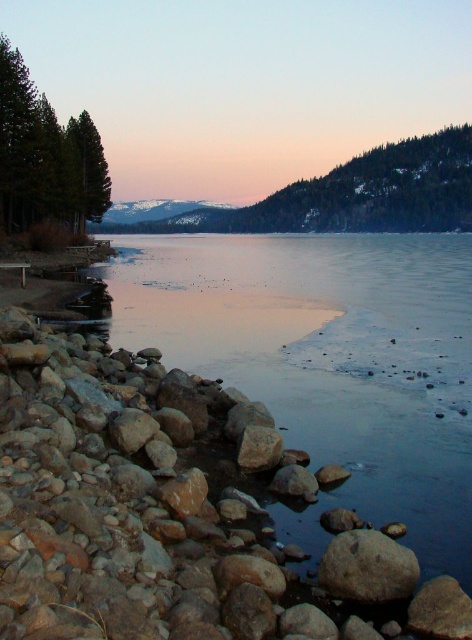
You are standing at the lakeside and want to take a photo of both point (101, 204) and point (359, 554). Which point will appear closer to the camera in the photo?

Point (101, 204) is further to the camera than point (359, 554), so point (359, 554) will appear closer to the camera in the photo.